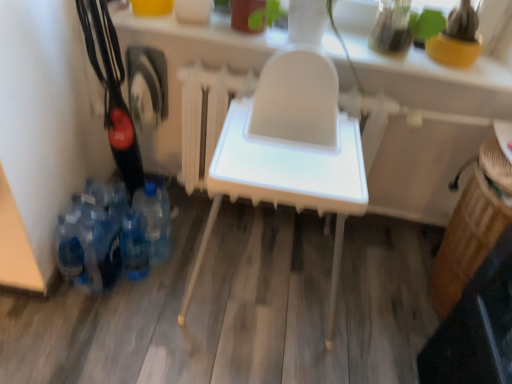
Question: Is there a large distance between blue translucent bottle at lower left, the second bottle in the left-to-right sequence, and blue plastic bottles at lower left, which ranks as the first bottle in left-to-right order?

Choices:
 (A) no
 (B) yes

Answer: (A)

Question: Does blue translucent bottle at lower left, the second bottle when ordered from right to left, have a smaller size compared to blue plastic bottles at lower left, the third bottle in the right-to-left sequence?

Choices:
 (A) no
 (B) yes

Answer: (B)

Question: Is blue translucent bottle at lower left, the second bottle in the left-to-right sequence, wider than blue plastic bottles at lower left, which ranks as the first bottle in left-to-right order?

Choices:
 (A) no
 (B) yes

Answer: (A)

Question: Does blue translucent bottle at lower left, the second bottle when ordered from right to left, have a lesser height compared to blue plastic bottles at lower left, which ranks as the first bottle in left-to-right order?

Choices:
 (A) no
 (B) yes

Answer: (B)

Question: Is blue translucent bottle at lower left, the second bottle when ordered from right to left, oriented towards blue plastic bottles at lower left, the third bottle in the right-to-left sequence?

Choices:
 (A) yes
 (B) no

Answer: (B)

Question: From a real-world perspective, does blue translucent bottle at lower left, the second bottle in the left-to-right sequence, stand above blue plastic bottles at lower left, the third bottle in the right-to-left sequence?

Choices:
 (A) yes
 (B) no

Answer: (B)

Question: From a real-world perspective, does blue plastic bottles at lower left, the third bottle in the right-to-left sequence, stand above blue translucent bottle at lower left, the second bottle when ordered from right to left?

Choices:
 (A) no
 (B) yes

Answer: (B)

Question: Could you tell me if blue plastic bottles at lower left, the third bottle in the right-to-left sequence, is turned towards blue translucent bottle at lower left, the second bottle in the left-to-right sequence?

Choices:
 (A) yes
 (B) no

Answer: (B)

Question: Can blue translucent bottle at lower left, the second bottle when ordered from right to left, be found inside blue plastic bottles at lower left, the third bottle in the right-to-left sequence?

Choices:
 (A) no
 (B) yes

Answer: (A)

Question: From the image's perspective, is blue plastic bottles at lower left, which ranks as the first bottle in left-to-right order, on blue translucent bottle at lower left, the second bottle when ordered from right to left?

Choices:
 (A) no
 (B) yes

Answer: (B)

Question: Considering the relative sizes of blue plastic bottles at lower left, the third bottle in the right-to-left sequence, and blue translucent bottle at lower left, the second bottle in the left-to-right sequence, in the image provided, is blue plastic bottles at lower left, the third bottle in the right-to-left sequence, bigger than blue translucent bottle at lower left, the second bottle in the left-to-right sequence,?

Choices:
 (A) yes
 (B) no

Answer: (A)

Question: Considering the relative sizes of blue plastic bottles at lower left, the third bottle in the right-to-left sequence, and blue translucent bottle at lower left, the second bottle when ordered from right to left, in the image provided, is blue plastic bottles at lower left, the third bottle in the right-to-left sequence, smaller than blue translucent bottle at lower left, the second bottle when ordered from right to left,?

Choices:
 (A) no
 (B) yes

Answer: (A)

Question: Can you confirm if white plastic highchair at center is bigger than blue translucent bottle at lower left, the second bottle when ordered from right to left?

Choices:
 (A) yes
 (B) no

Answer: (A)